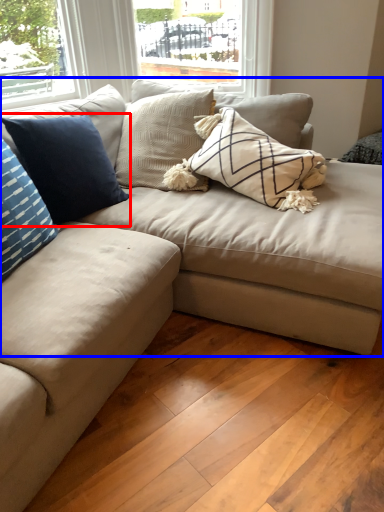
Question: Which object appears closest to the camera in this image, pillow (highlighted by a red box) or studio couch (highlighted by a blue box)?

Choices:
 (A) pillow
 (B) studio couch

Answer: (B)